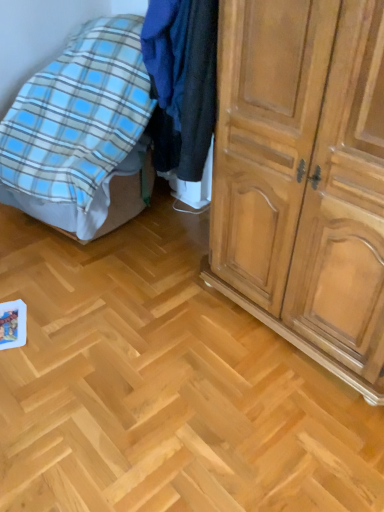
Question: Is light brown wooden cupboard at right in front of or behind blue plaid blanket at left in the image?

Choices:
 (A) front
 (B) behind

Answer: (A)

Question: Considering the positions of light brown wooden cupboard at right and blue plaid blanket at left in the image, is light brown wooden cupboard at right wider or thinner than blue plaid blanket at left?

Choices:
 (A) wide
 (B) thin

Answer: (B)

Question: Based on their sizes in the image, would you say light brown wooden cupboard at right is bigger or smaller than blue plaid blanket at left?

Choices:
 (A) big
 (B) small

Answer: (B)

Question: From the image's perspective, is blue plaid blanket at left above or below light brown wooden cupboard at right?

Choices:
 (A) above
 (B) below

Answer: (A)

Question: In terms of height, does blue plaid blanket at left look taller or shorter compared to light brown wooden cupboard at right?

Choices:
 (A) tall
 (B) short

Answer: (B)

Question: Would you say blue plaid blanket at left is to the left or to the right of light brown wooden cupboard at right in the picture?

Choices:
 (A) left
 (B) right

Answer: (A)

Question: Considering the positions of point (89, 226) and point (278, 263), is point (89, 226) closer or farther from the camera than point (278, 263)?

Choices:
 (A) closer
 (B) farther

Answer: (B)